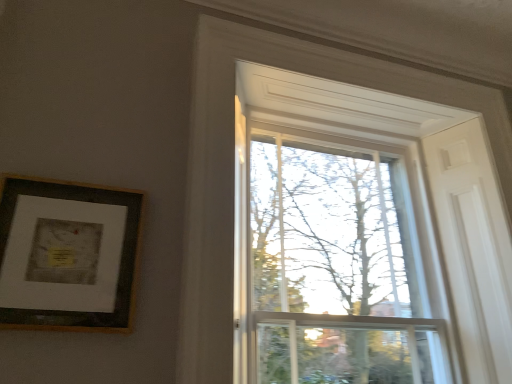
Question: Can you confirm if wooden framed print at upper left is smaller than clear glass window at upper center?

Choices:
 (A) no
 (B) yes

Answer: (B)

Question: Is wooden framed print at upper left bigger than clear glass window at upper center?

Choices:
 (A) no
 (B) yes

Answer: (A)

Question: From a real-world perspective, is wooden framed print at upper left on clear glass window at upper center?

Choices:
 (A) no
 (B) yes

Answer: (A)

Question: Does wooden framed print at upper left have a lesser width compared to clear glass window at upper center?

Choices:
 (A) yes
 (B) no

Answer: (A)

Question: Considering the relative sizes of wooden framed print at upper left and clear glass window at upper center in the image provided, is wooden framed print at upper left taller than clear glass window at upper center?

Choices:
 (A) yes
 (B) no

Answer: (B)

Question: Does wooden framed print at upper left turn towards clear glass window at upper center?

Choices:
 (A) no
 (B) yes

Answer: (A)

Question: Could you tell me if clear glass window at upper center is turned towards wooden framed print at upper left?

Choices:
 (A) yes
 (B) no

Answer: (B)

Question: Can you confirm if clear glass window at upper center is smaller than wooden framed print at upper left?

Choices:
 (A) yes
 (B) no

Answer: (B)

Question: Can you confirm if clear glass window at upper center is bigger than wooden framed print at upper left?

Choices:
 (A) yes
 (B) no

Answer: (A)

Question: Can you confirm if clear glass window at upper center is wider than wooden framed print at upper left?

Choices:
 (A) no
 (B) yes

Answer: (B)

Question: Can you confirm if clear glass window at upper center is positioned to the left of wooden framed print at upper left?

Choices:
 (A) no
 (B) yes

Answer: (A)

Question: Is clear glass window at upper center oriented away from wooden framed print at upper left?

Choices:
 (A) no
 (B) yes

Answer: (A)

Question: Considering the positions of wooden framed print at upper left and clear glass window at upper center in the image, is wooden framed print at upper left taller or shorter than clear glass window at upper center?

Choices:
 (A) tall
 (B) short

Answer: (B)